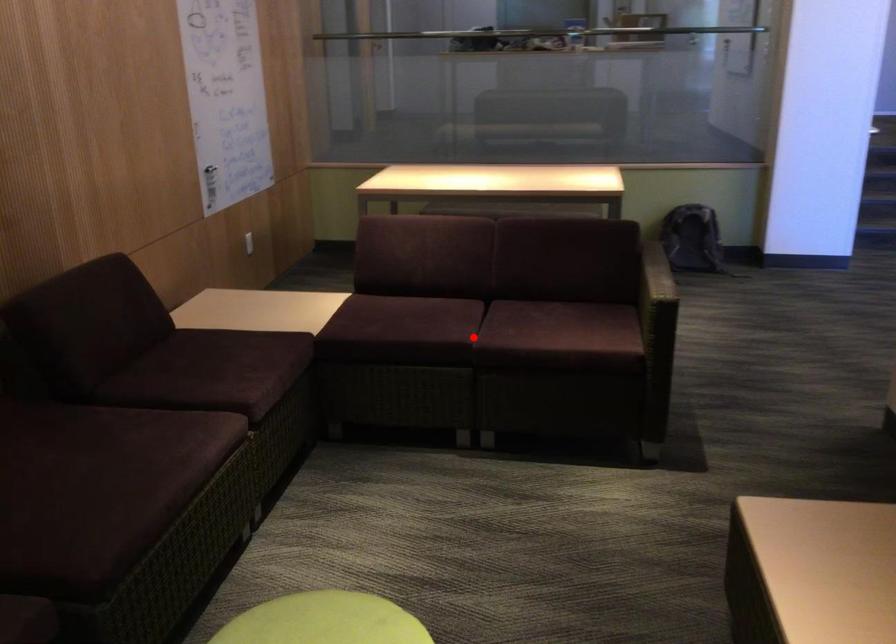
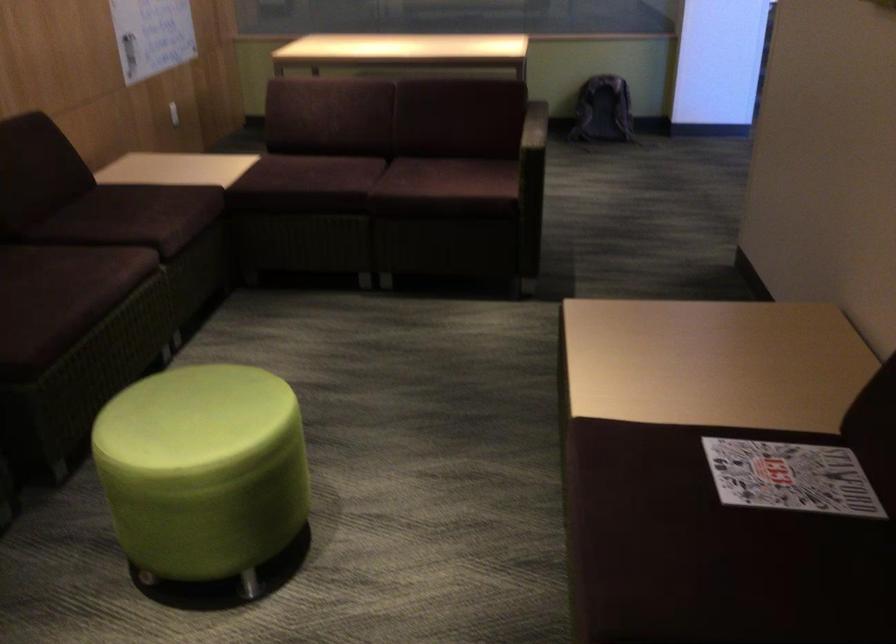
Question: I am providing you with two images of the same scene from different viewpoints. Image1 has a red point marked. In image2, the corresponding 3D location appears at what relative position? Reply with the corresponding letter.

Choices:
 (A) Closer
 (B) Farther

Answer: (B)